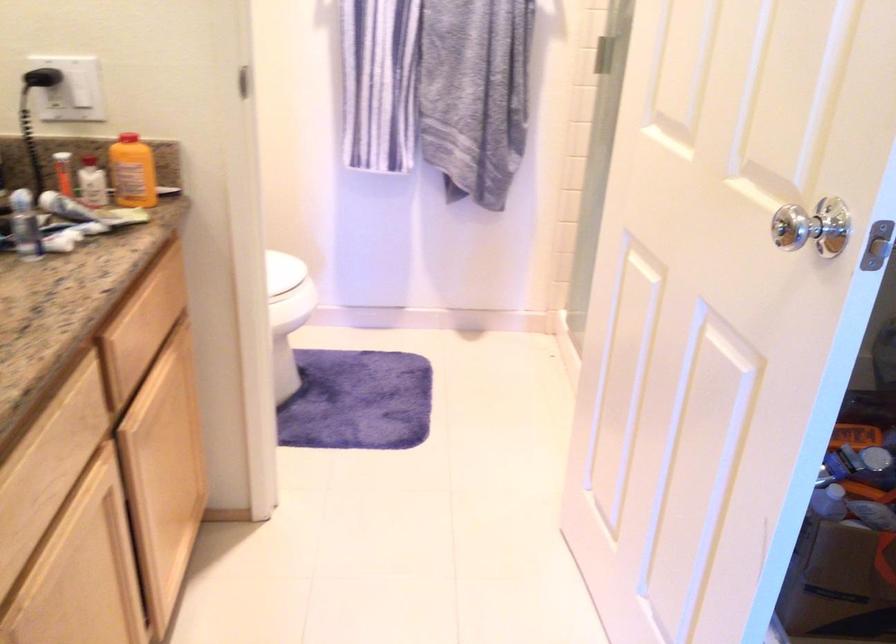
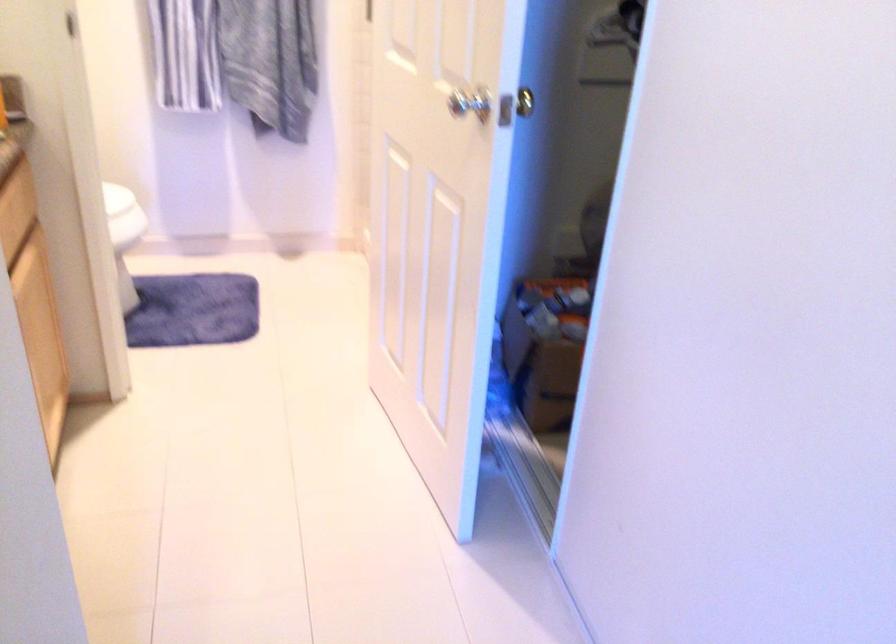
The point at (133, 339) is marked in the first image. Where is the corresponding point in the second image?

(12, 229)